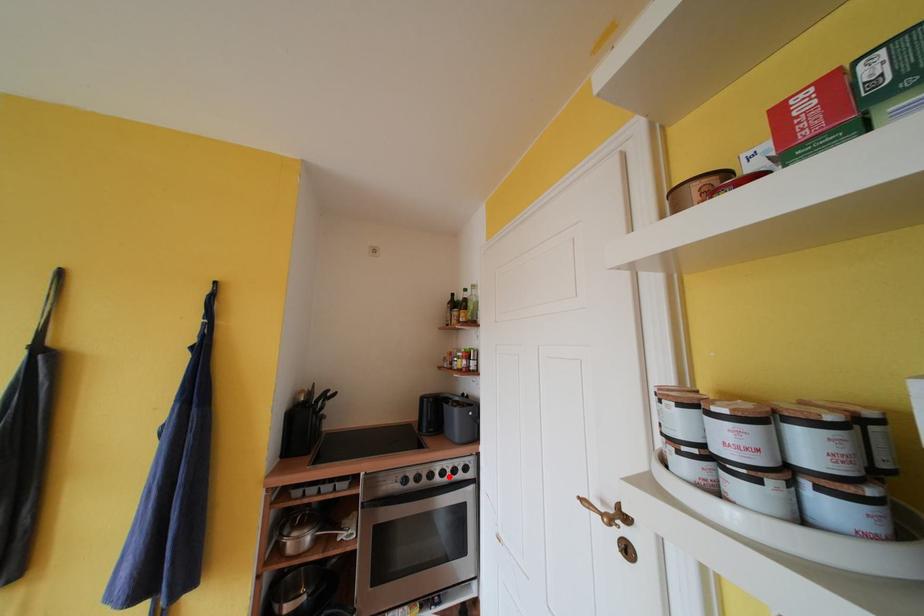
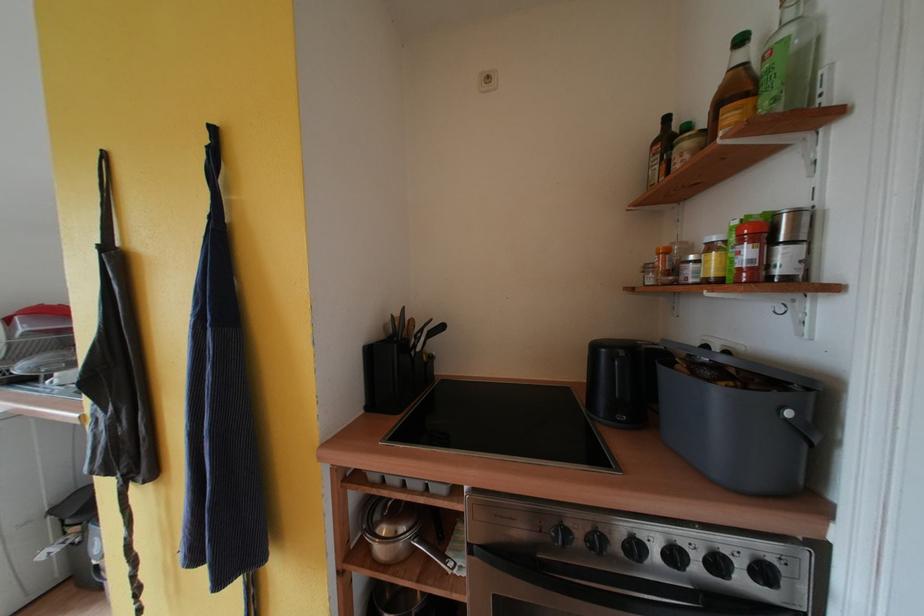
Question: I am providing you with two images of the same scene from different viewpoints. Given a red point in image1, look at the same physical point in image2. Is it:

Choices:
 (A) Closer to the viewpoint
 (B) Farther from the viewpoint

Answer: (A)